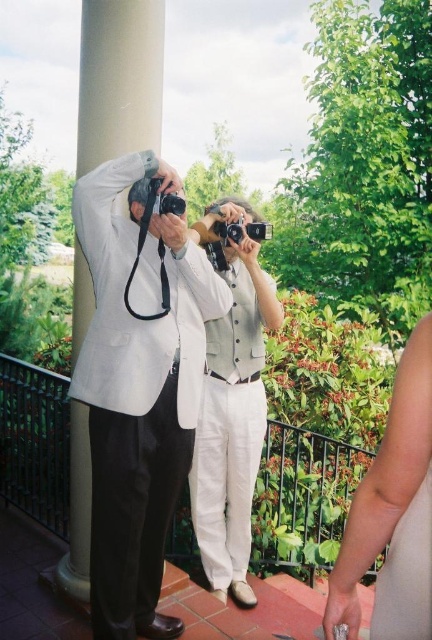
Question: Which object appears closest to the camera in this image?

Choices:
 (A) smooth beige arm at lower right
 (B) light gray cotton vest at center
 (C) matte white suit at left

Answer: (A)

Question: Among these points, which one is nearest to the camera?

Choices:
 (A) (83, 125)
 (B) (218, 221)
 (C) (232, 348)

Answer: (A)

Question: Is light gray cotton vest at center smaller than white smooth pillar at center?

Choices:
 (A) no
 (B) yes

Answer: (A)

Question: In this image, where is light gray cotton vest at center located relative to white smooth pillar at center?

Choices:
 (A) below
 (B) above

Answer: (B)

Question: Which point is closer to the camera?

Choices:
 (A) (251, 237)
 (B) (120, 29)
 (C) (164, 634)
 (D) (425, 476)

Answer: (D)

Question: Is smooth beige arm at lower right closer to camera compared to white smooth pillar at center?

Choices:
 (A) yes
 (B) no

Answer: (A)